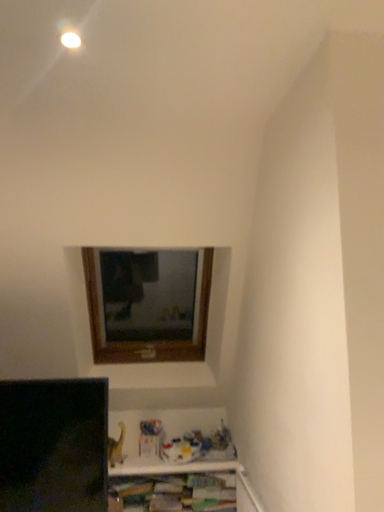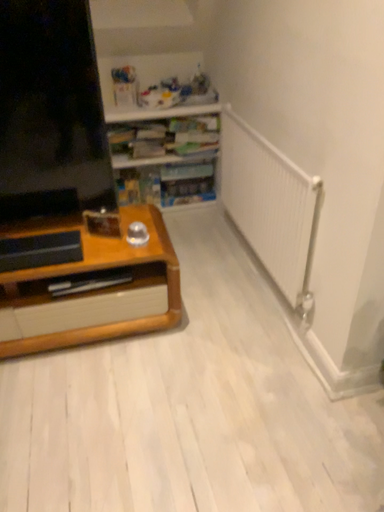
Question: Which way did the camera rotate in the video?

Choices:
 (A) rotated right
 (B) rotated left

Answer: (A)